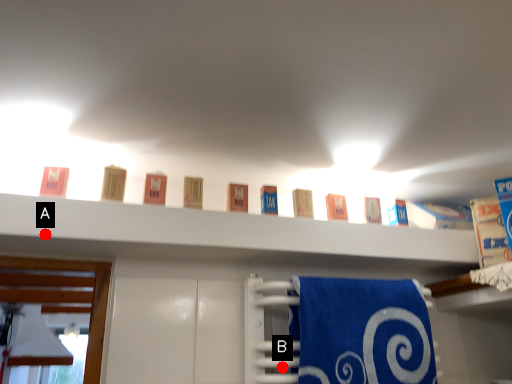
Question: Two points are circled on the image, labeled by A and B beside each circle. Which point is closer to the camera?

Choices:
 (A) A is closer
 (B) B is closer

Answer: (A)